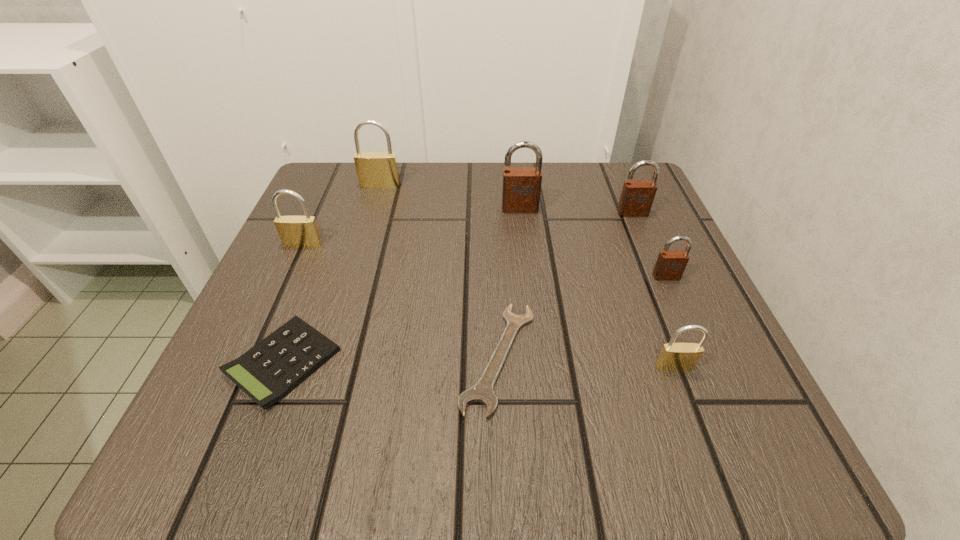
The width and height of the screenshot is (960, 540). In order to click on the fourth nearest object in this screenshot , I will do `click(670, 265)`.

I want to click on calculator, so pyautogui.click(x=270, y=370).

Where is `wrench`? This screenshot has width=960, height=540. wrench is located at coordinates (482, 392).

You are a GUI agent. You are given a task and a screenshot of the screen. Output one action in this format:
    pyautogui.click(x=<x>, y=<y>)
    Task: Click on the blank space located on the front-facing side of the farthest brass padlock
    Image resolution: width=960 pixels, height=540 pixels.
    Given the screenshot: What is the action you would take?
    pyautogui.click(x=372, y=215)

Where is `vacant space positioned on the front-facing side of the leftmost brown padlock`? vacant space positioned on the front-facing side of the leftmost brown padlock is located at coordinates (525, 255).

This screenshot has height=540, width=960. I want to click on vacant region located on the front-facing side of the second smallest brown padlock, so click(x=640, y=232).

Find the location of a particular element. free region located on the front-facing side of the third nearest padlock is located at coordinates (247, 371).

Identify the location of free point located 0.110m on the front-facing side of the smallest brass padlock. The width and height of the screenshot is (960, 540). (705, 446).

Find the location of `vacant space located 0.180m on the front-facing side of the fifth farthest object`. vacant space located 0.180m on the front-facing side of the fifth farthest object is located at coordinates (707, 369).

Where is `vacant space located 0.360m on the right of the seventh tallest object`? The image size is (960, 540). vacant space located 0.360m on the right of the seventh tallest object is located at coordinates (587, 362).